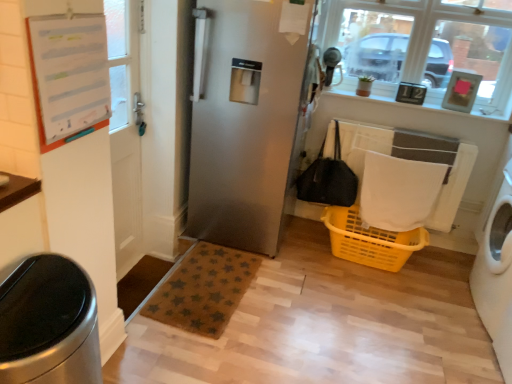
Find the location of a particular element. empty space that is ontop of brushed metal trash can at lower left (from a real-world perspective) is located at coordinates (33, 281).